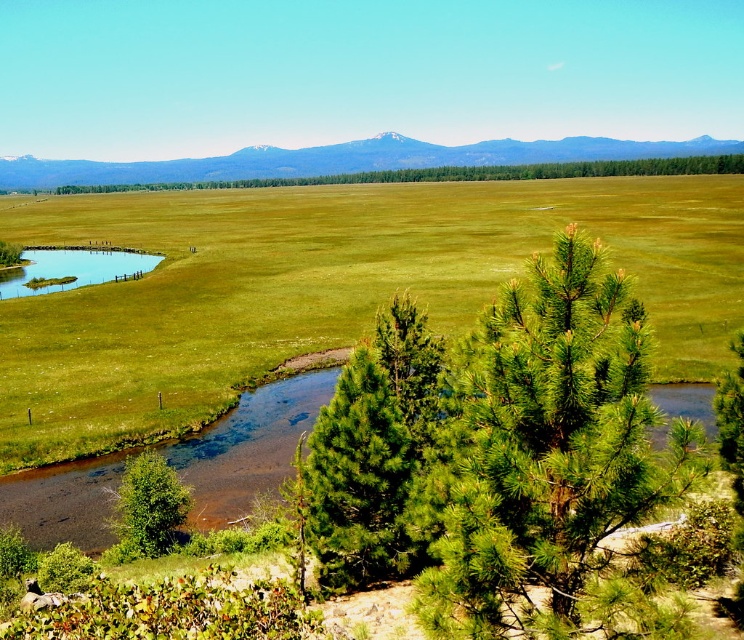
Question: Does green grassy field at center have a lesser width compared to green leafy tree at lower left?

Choices:
 (A) no
 (B) yes

Answer: (A)

Question: Which object appears closest to the camera in this image?

Choices:
 (A) green needle-like at center
 (B) green pine tree at center
 (C) green leafy tree at lower left
 (D) green grassy field at center

Answer: (A)

Question: Is green grassy field at center smaller than green needle-like at center?

Choices:
 (A) no
 (B) yes

Answer: (A)

Question: Which object is the closest to the green pine tree at center?

Choices:
 (A) green needle-like at center
 (B) green leafy tree at lower left

Answer: (B)

Question: Which object is positioned farthest from the green pine tree at center?

Choices:
 (A) green leafy tree at lower left
 (B) green needle-like at center
 (C) green grassy field at center

Answer: (B)

Question: Can you confirm if green needle-like at center is smaller than green leafy tree at lower left?

Choices:
 (A) no
 (B) yes

Answer: (A)